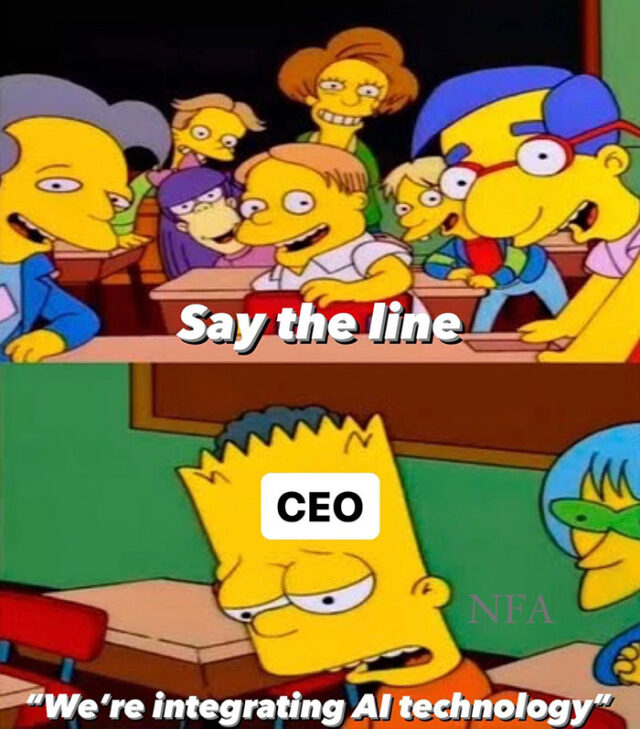
Find the location of a particular element. bulletin board is located at coordinates (492, 401).